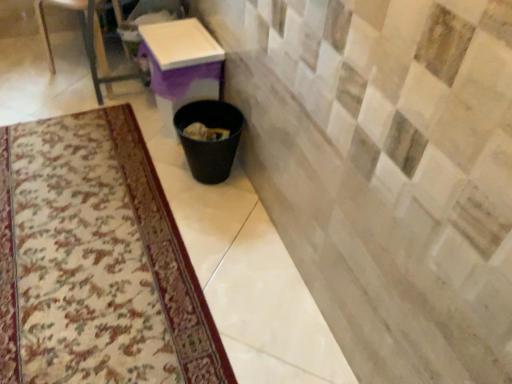
Locate an element on the screen. Image resolution: width=512 pixels, height=384 pixels. free space below metallic glass table at upper left (from a real-world perspective) is located at coordinates (77, 78).